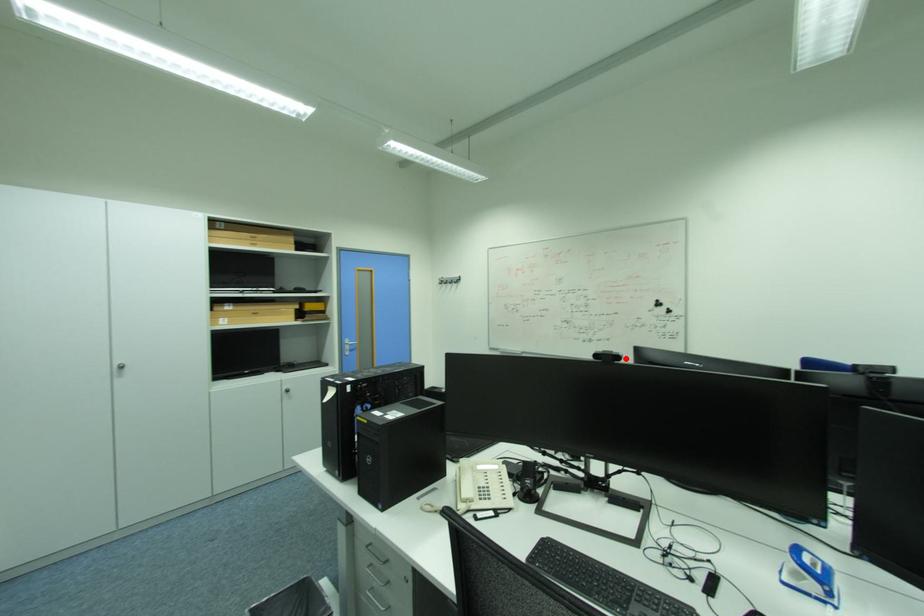
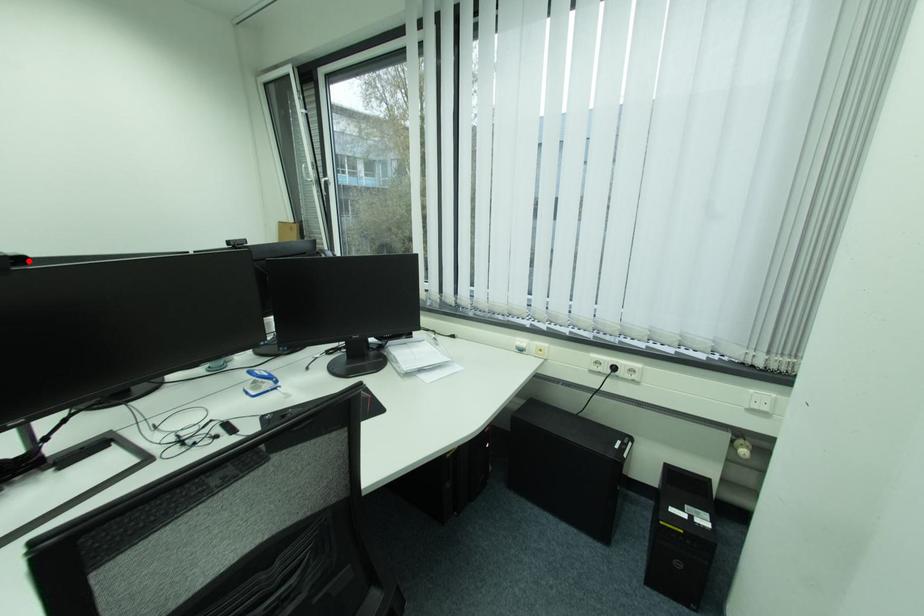
I am providing you with two images of the same scene from different viewpoints. A red point is marked on the first image and another point is marked on the second image. Is the marked point in image1 the same physical position as the marked point in image2?

Yes